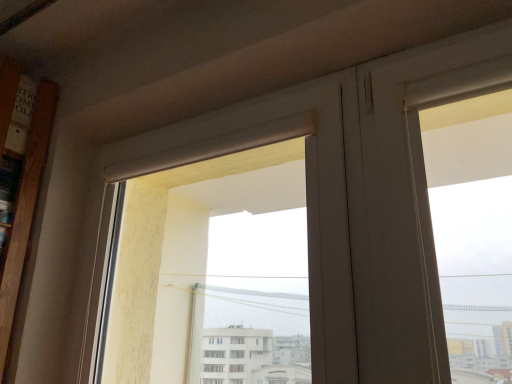
You are a GUI agent. You are given a task and a screenshot of the screen. Output one action in this format:
    pyautogui.click(x=<x>, y=<y>)
    Task: Click on the white matte window at upper center
    The width and height of the screenshot is (512, 384).
    Given the screenshot: What is the action you would take?
    pyautogui.click(x=307, y=195)

What do you see at coordinates (307, 195) in the screenshot? I see `white matte window at upper center` at bounding box center [307, 195].

Based on the photo, measure the distance between point (327,298) and camera.

Point (327,298) and camera are 84.10 centimeters apart.

Identify the location of white matte window at upper center. (307, 195).